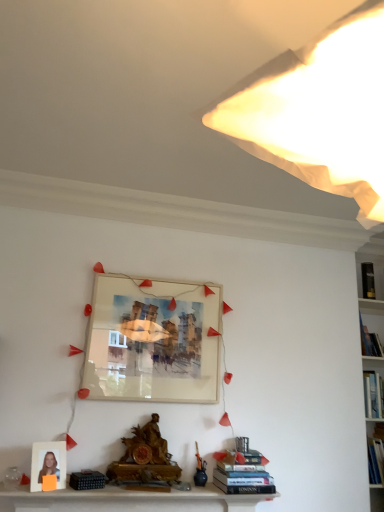
Locate an element on the screen. vacant point to the left of white matte photo frame at lower left, marked as the first picture frame in a bottom-to-top arrangement is located at coordinates (18, 494).